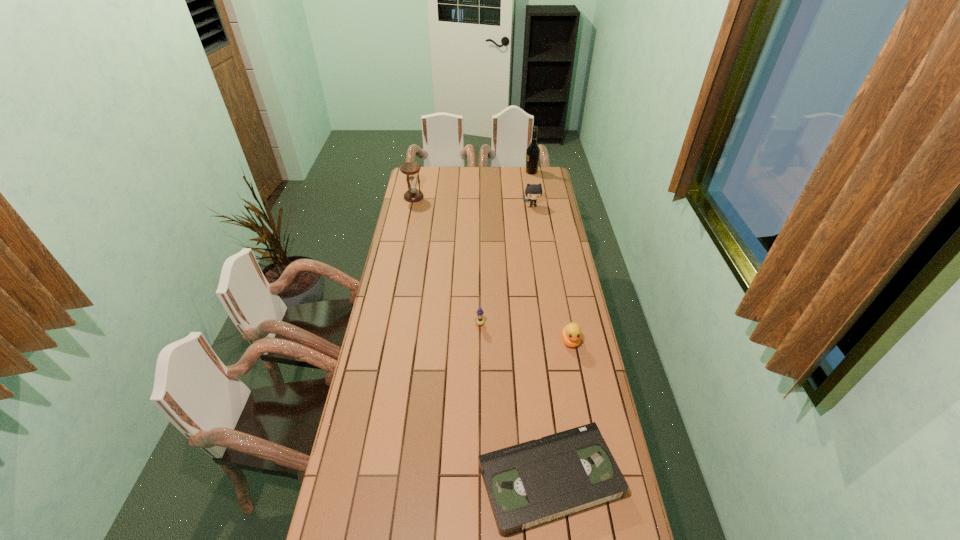
Identify which object is the fifth closest to the hourglass. Please provide its 2D coordinates. Your answer should be formatted as a tuple, i.e. [(x, y)], where the tuple contains the x and y coordinates of a point satisfying the conditions above.

[(538, 481)]

You are a GUI agent. You are given a task and a screenshot of the screen. Output one action in this format:
    pyautogui.click(x=<x>, y=<y>)
    Task: Click on the free space in the image that satisfies the following two spatial constraints: 1. on the front side of the nearest object; 2. on the left side of the leftmost object
    
    Given the screenshot: What is the action you would take?
    pyautogui.click(x=357, y=479)

Where is `vacant space that satisfies the following two spatial constraints: 1. on the label of the tallest object; 2. on the face of the fourth farthest object, where the monocle is placed`? Image resolution: width=960 pixels, height=540 pixels. vacant space that satisfies the following two spatial constraints: 1. on the label of the tallest object; 2. on the face of the fourth farthest object, where the monocle is placed is located at coordinates (557, 325).